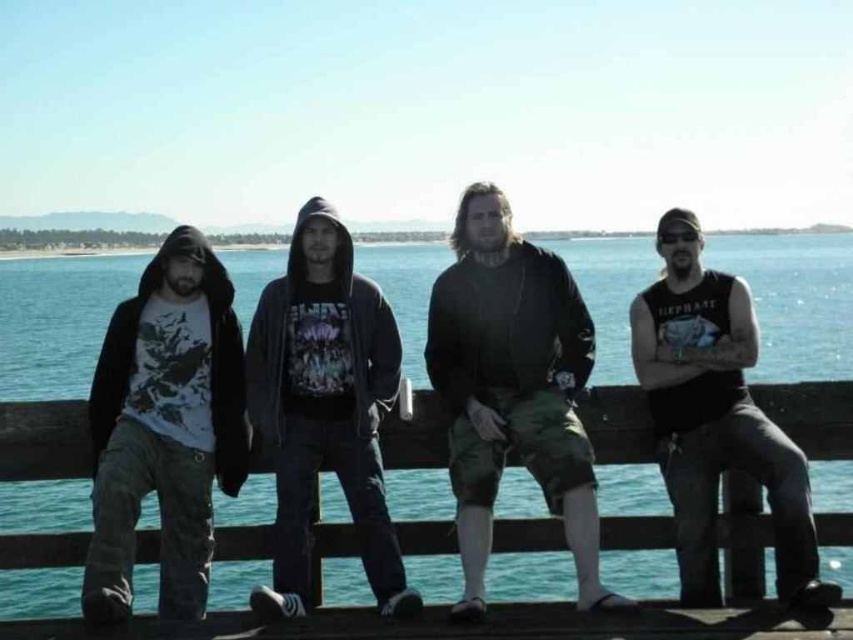
Question: Does dark green camo shorts at center appear on the left side of dark gray hoodie at center?

Choices:
 (A) yes
 (B) no

Answer: (B)

Question: Observing the image, what is the correct spatial positioning of dark green camo shorts at center in reference to black tank top at right?

Choices:
 (A) right
 (B) left

Answer: (B)

Question: Which of these objects is positioned closest to the blue water at center?

Choices:
 (A) dark gray hoodie at center
 (B) black tank top at right
 (C) dark green camo shorts at center

Answer: (C)

Question: Is dark green camo shorts at center smaller than black tank top at right?

Choices:
 (A) no
 (B) yes

Answer: (A)

Question: Based on their relative distances, which object is nearer to the dark green camo shorts at center?

Choices:
 (A) dark gray hoodie at center
 (B) black tank top at right

Answer: (A)

Question: Which object is the farthest from the dark gray hoodie at center?

Choices:
 (A) black tank top at right
 (B) blue water at center
 (C) dark green camo shorts at center
 (D) matte black hoodie at left

Answer: (B)